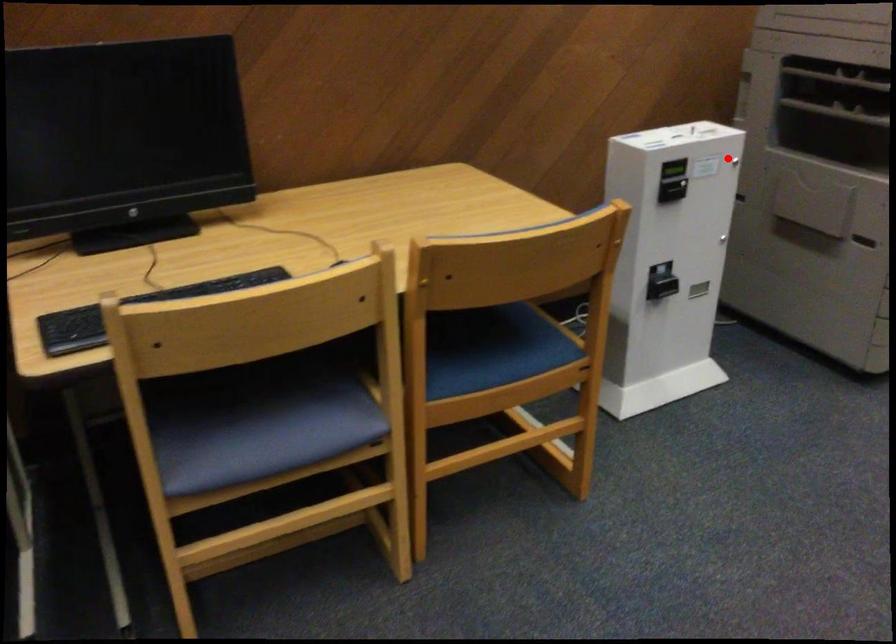
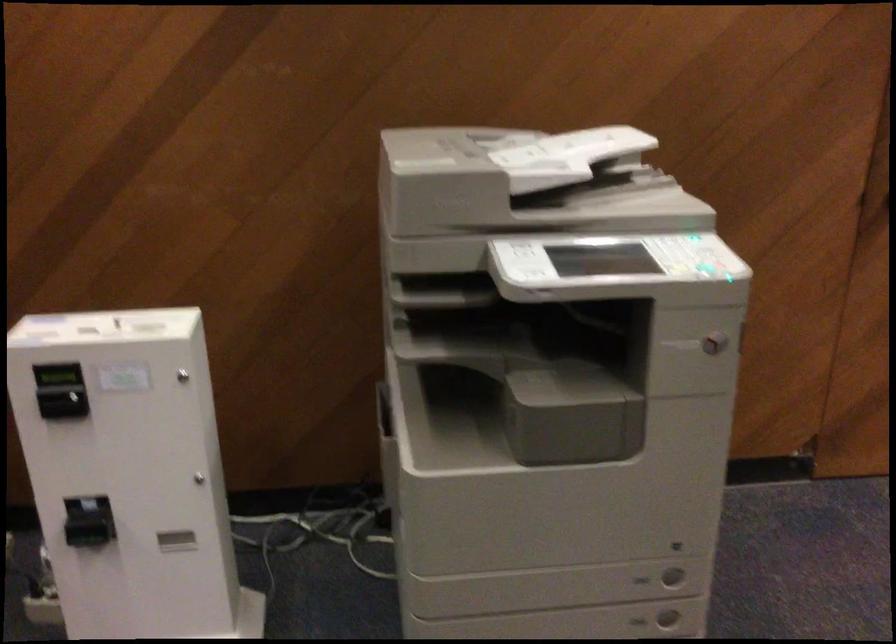
Find the pixel in the second image that matches the highlighted location in the first image.

(183, 375)